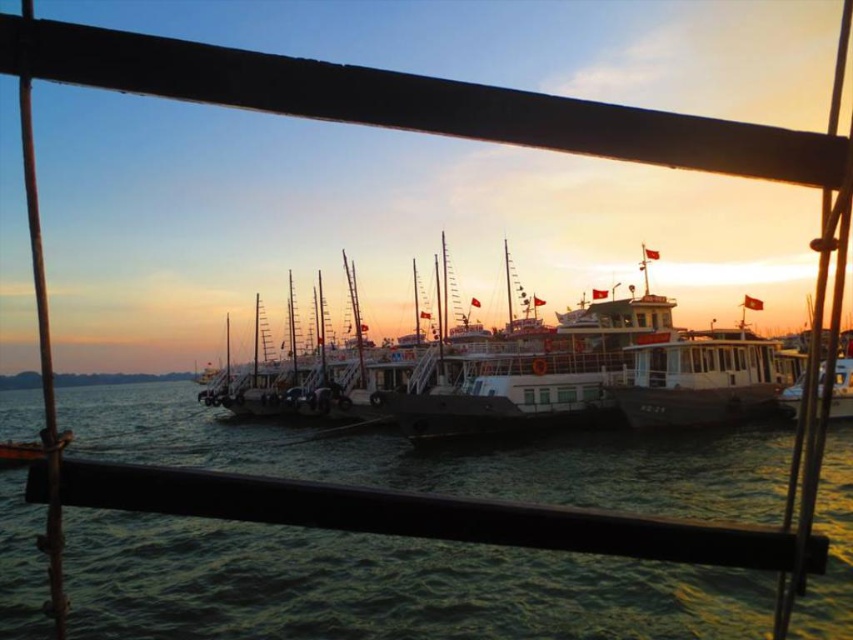
From the picture: Can you confirm if green water at center is positioned to the left of white matte boat at center?

Correct, you'll find green water at center to the left of white matte boat at center.

Which is behind, point (508, 611) or point (743, 362)?

Point (743, 362)

You are a GUI agent. You are given a task and a screenshot of the screen. Output one action in this format:
    pyautogui.click(x=<x>, y=<y>)
    Task: Click on the green water at center
    
    Given the screenshot: What is the action you would take?
    pyautogui.click(x=380, y=588)